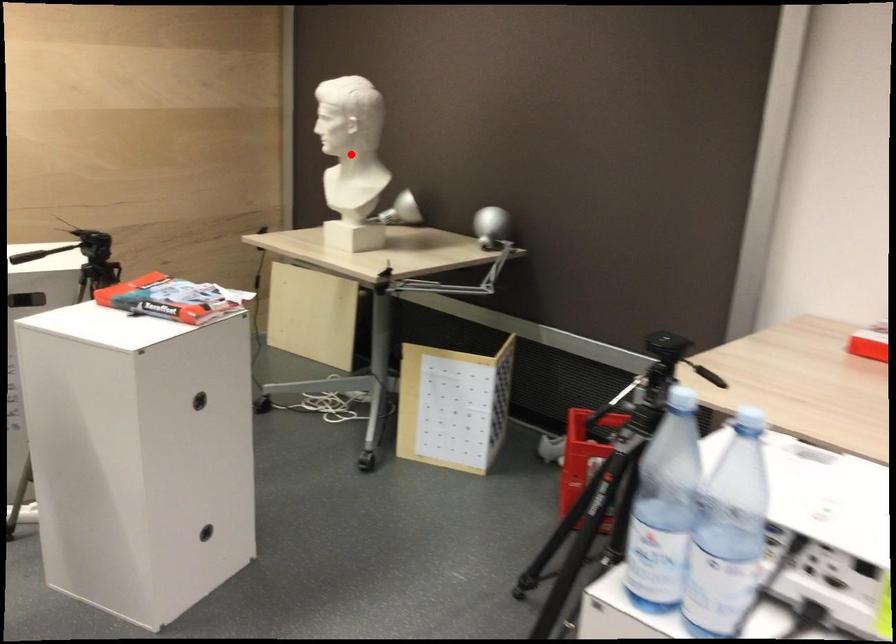
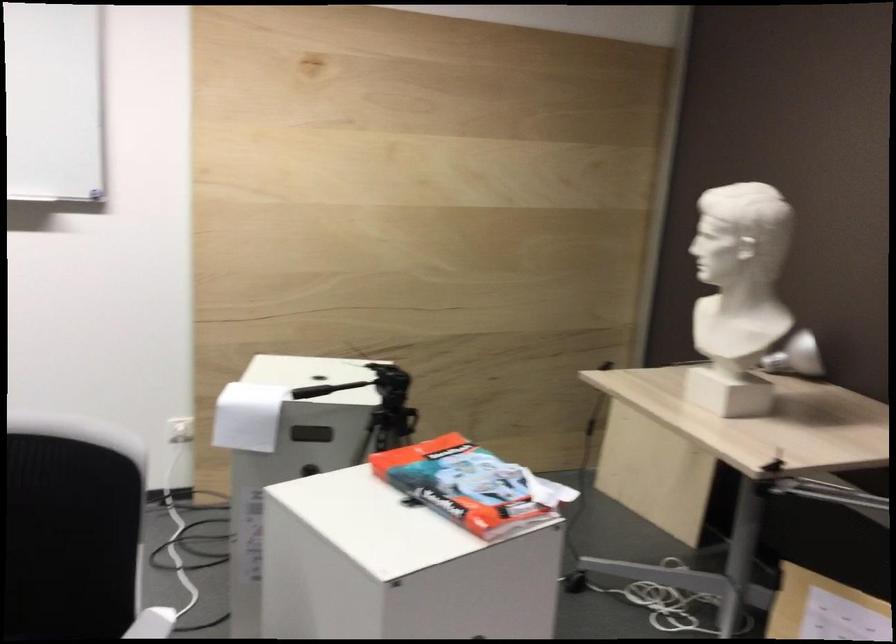
Locate, in the second image, the point that corresponds to the highlighted location in the first image.

(746, 281)